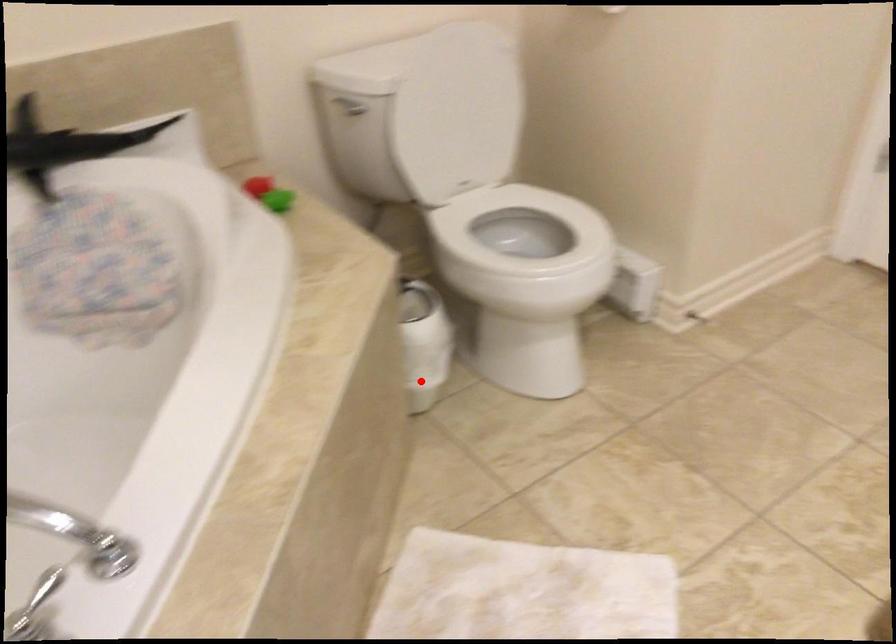
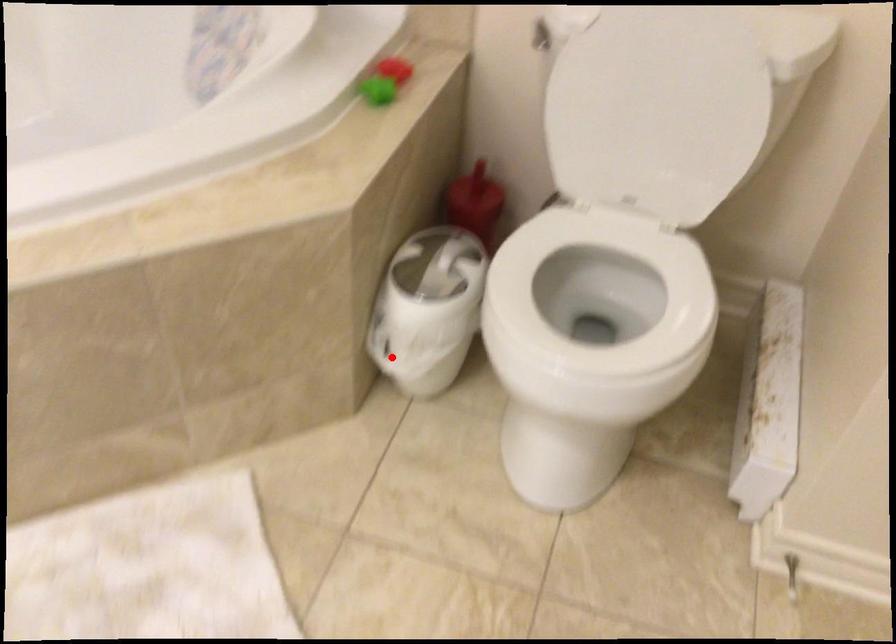
I am providing you with two images of the same scene from different viewpoints. A red point is marked on the first image and another point is marked on the second image. Is the marked point in image1 the same physical position as the marked point in image2?

Yes